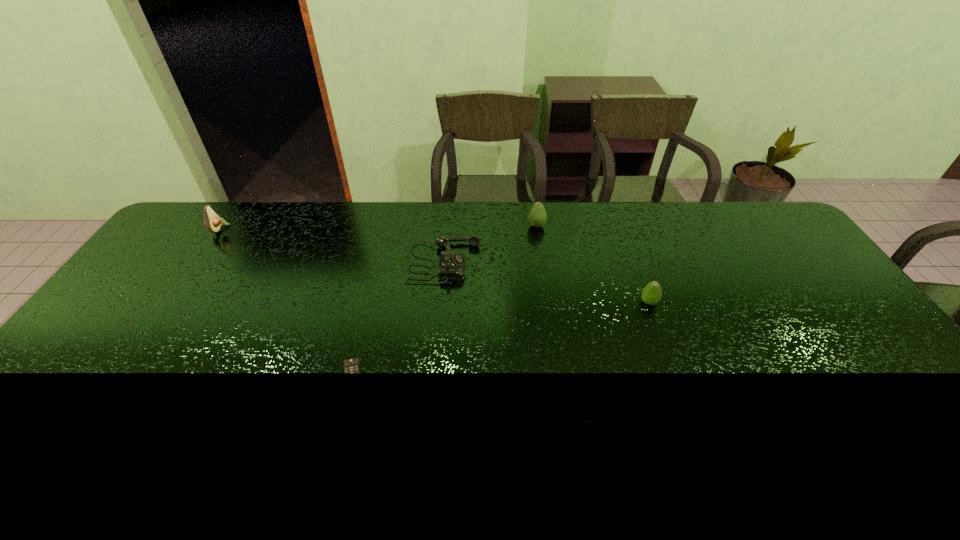
Select which object appears as the second closest to the leftmost avocado. Please provide its 2D coordinates. Your answer should be formatted as a tuple, i.e. [(x, y)], where the tuple contains the x and y coordinates of a point satisfying the conditions above.

[(350, 365)]

Identify the location of object that is the second closest to the rightmost object. (451, 265).

Identify which avocado is the second closest to the tallest avocado. Please provide its 2D coordinates. Your answer should be formatted as a tuple, i.e. [(x, y)], where the tuple contains the x and y coordinates of a point satisfying the conditions above.

[(652, 292)]

You are a GUI agent. You are given a task and a screenshot of the screen. Output one action in this format:
    pyautogui.click(x=<x>, y=<y>)
    Task: Click on the avocado that is the closest to the shortest object
    The width and height of the screenshot is (960, 540).
    Given the screenshot: What is the action you would take?
    pyautogui.click(x=537, y=216)

What are the coordinates of `free space that satisfies the following two spatial constraints: 1. on the dial of the telephone; 2. on the right side of the nearest avocado` in the screenshot? It's located at (441, 302).

The image size is (960, 540). I want to click on vacant region that satisfies the following two spatial constraints: 1. on the dial of the rightmost avocado; 2. on the right side of the third nearest object, so click(441, 302).